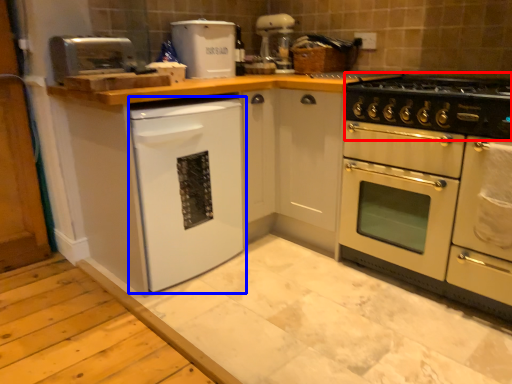
Question: Which object appears closest to the camera in this image, gas stove (highlighted by a red box) or dish washer (highlighted by a blue box)?

Choices:
 (A) gas stove
 (B) dish washer

Answer: (A)